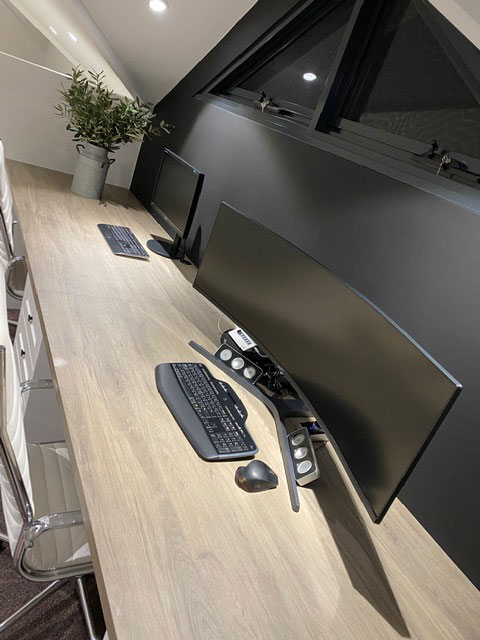
Locate an element on the screen. This screenshot has width=480, height=640. metal chair frame is located at coordinates (78, 572), (74, 515), (17, 481), (3, 355).